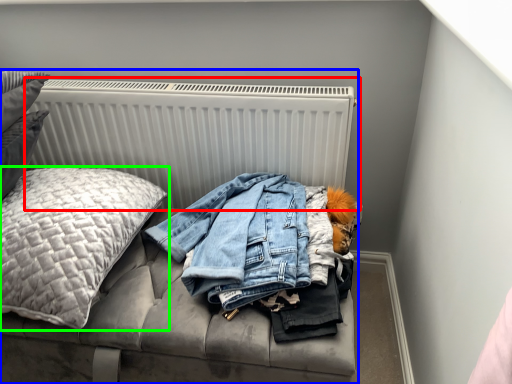
Question: Which is farther away from radiator (highlighted by a red box)? furniture (highlighted by a blue box) or pillow (highlighted by a green box)?

Choices:
 (A) furniture
 (B) pillow

Answer: (B)